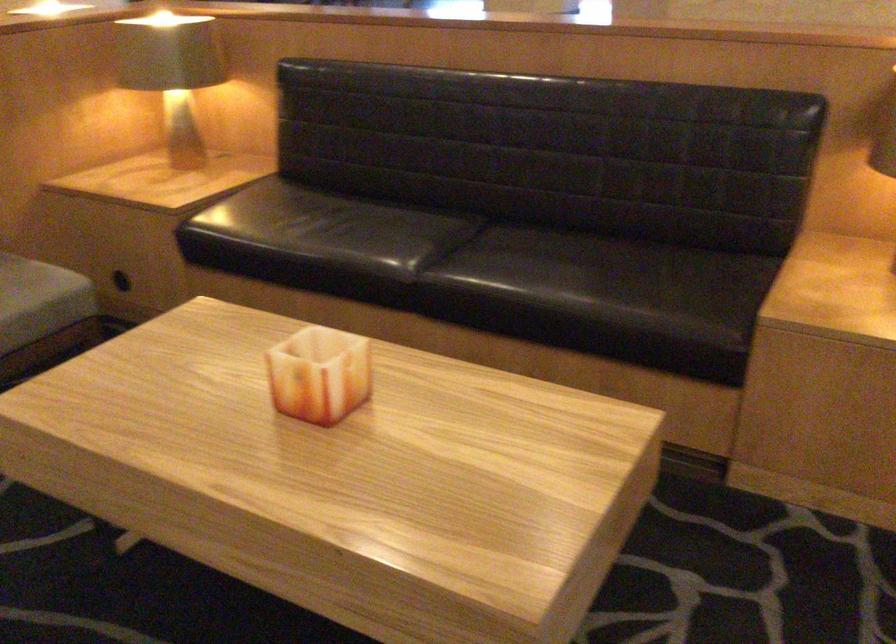
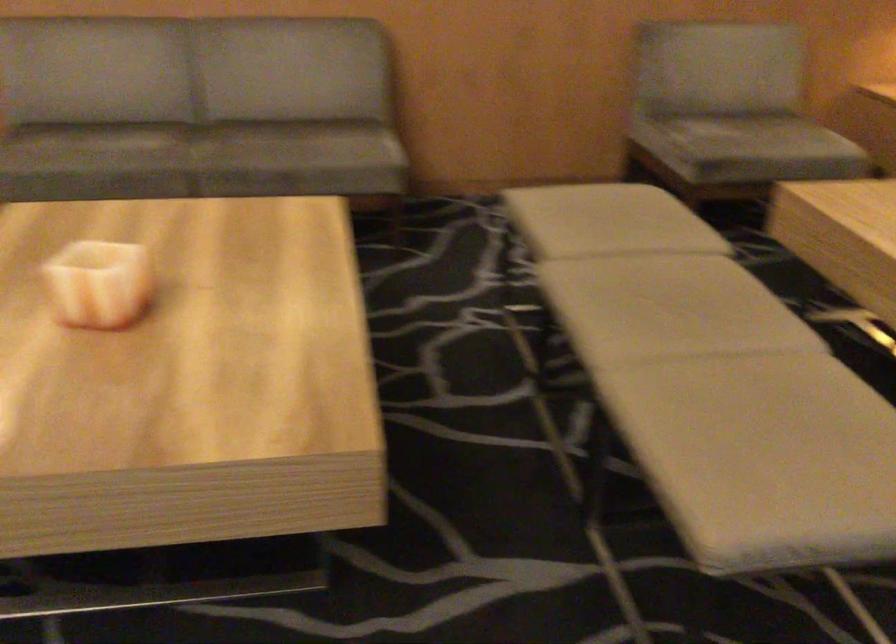
Question: The camera is either moving clockwise (left) or counter-clockwise (right) around the object. The first image is from the beginning of the video and the second image is from the end. Is the camera moving left or right when shooting the video?

Choices:
 (A) Left
 (B) Right

Answer: (B)